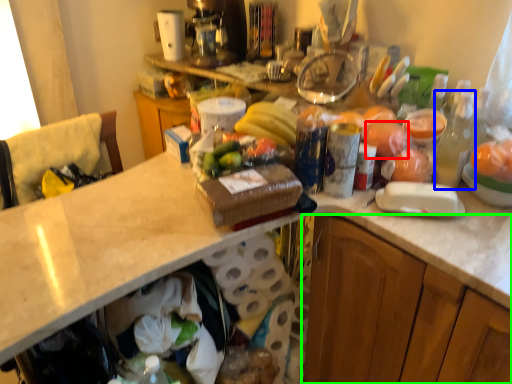
Question: Estimate the real-world distances between objects in this image. Which object is farther from food (highlighted by a red box), bottle (highlighted by a blue box) or cabinetry (highlighted by a green box)?

Choices:
 (A) bottle
 (B) cabinetry

Answer: (B)